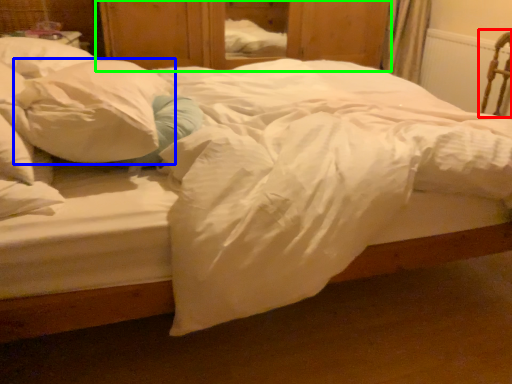
Question: Which object is positioned farthest from armchair (highlighted by a red box)? Select from pillow (highlighted by a blue box) and dresser (highlighted by a green box).

Choices:
 (A) pillow
 (B) dresser

Answer: (A)